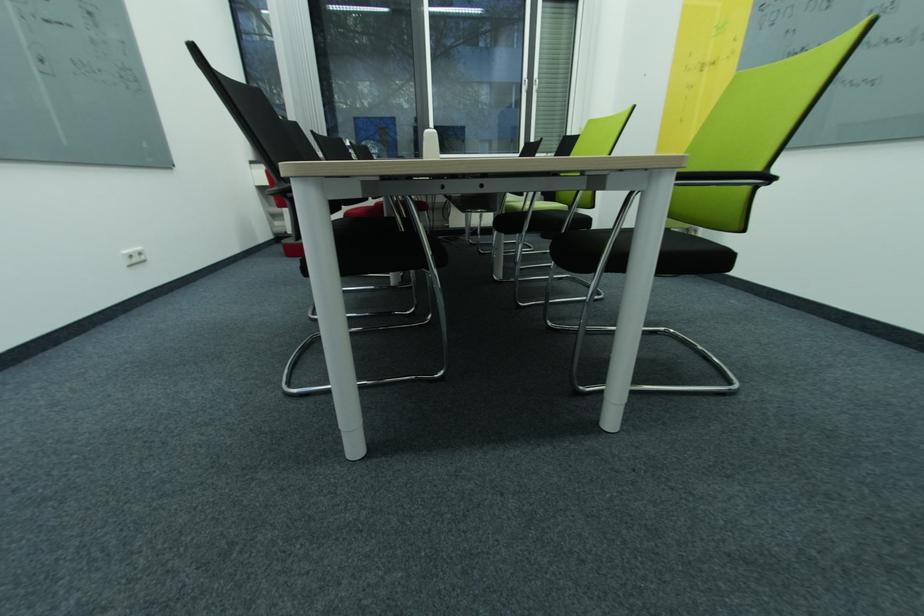
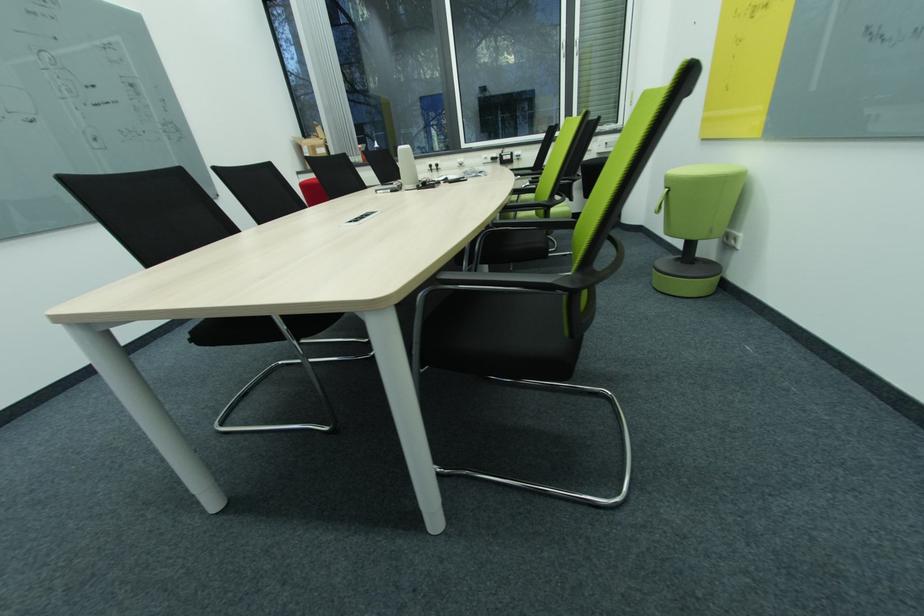
Question: The first image is from the beginning of the video and the second image is from the end. How did the camera likely rotate when shooting the video?

Choices:
 (A) Left
 (B) Right
 (C) Up
 (D) Down

Answer: (A)